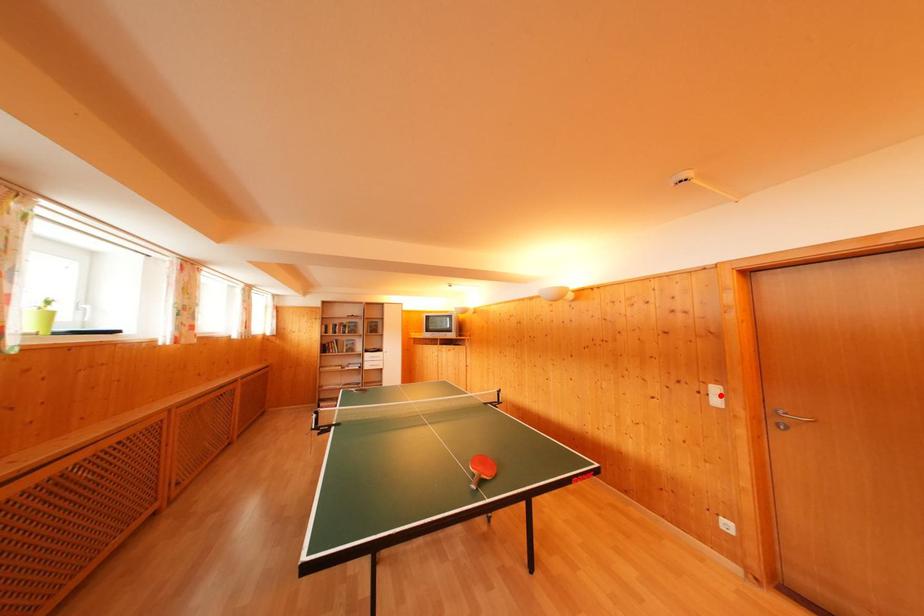
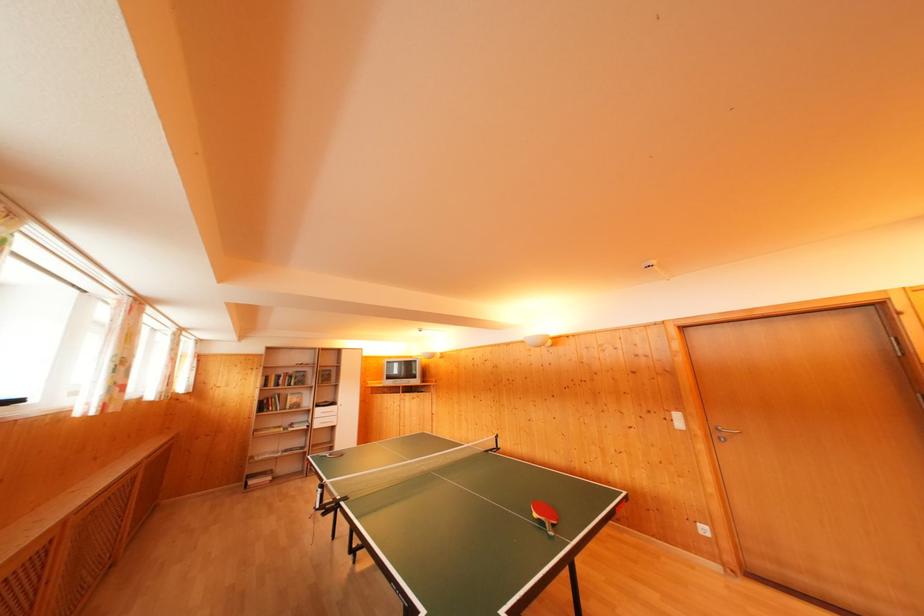
Find the pixel in the second image that matches the highlighted location in the first image.

(682, 421)